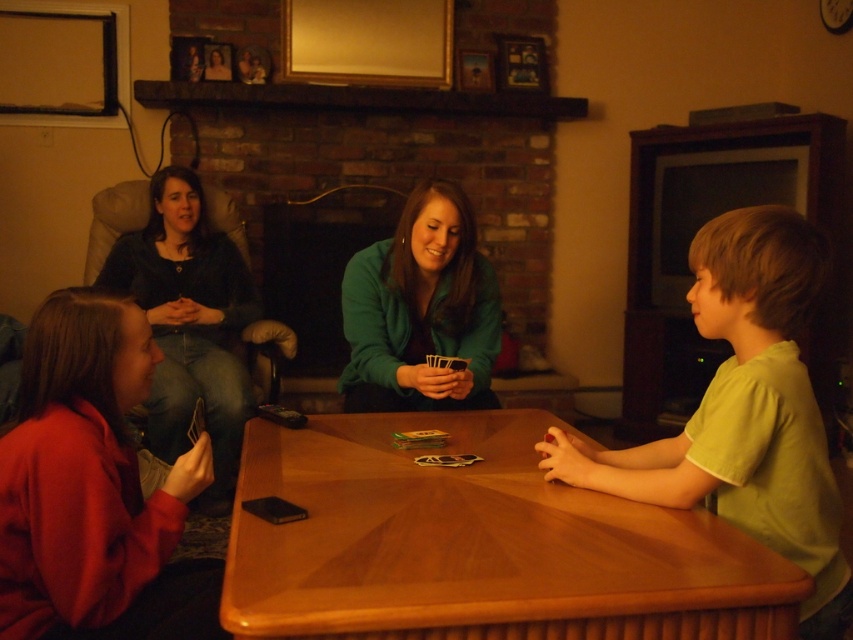
Can you confirm if wooden table at center is bigger than matte black shirt at left?

Incorrect, wooden table at center is not larger than matte black shirt at left.

Does wooden table at center appear over matte black shirt at left?

No.

The image size is (853, 640). In order to click on wooden table at center in this screenshot , I will do `click(477, 545)`.

Does wooden table at center have a greater width compared to shiny plastic cards at center?

Yes.

Which of these two, wooden table at center or shiny plastic cards at center, stands shorter?

shiny plastic cards at center

The width and height of the screenshot is (853, 640). I want to click on wooden table at center, so click(x=477, y=545).

Who is positioned more to the right, green matte card at center or brick fireplace at center?

From the viewer's perspective, green matte card at center appears more on the right side.

Between point (463, 397) and point (317, 100), which one is positioned behind?

Point (317, 100)

You are a GUI agent. You are given a task and a screenshot of the screen. Output one action in this format:
    pyautogui.click(x=<x>, y=<y>)
    Task: Click on the green matte card at center
    Image resolution: width=853 pixels, height=640 pixels.
    Given the screenshot: What is the action you would take?
    pyautogui.click(x=421, y=310)